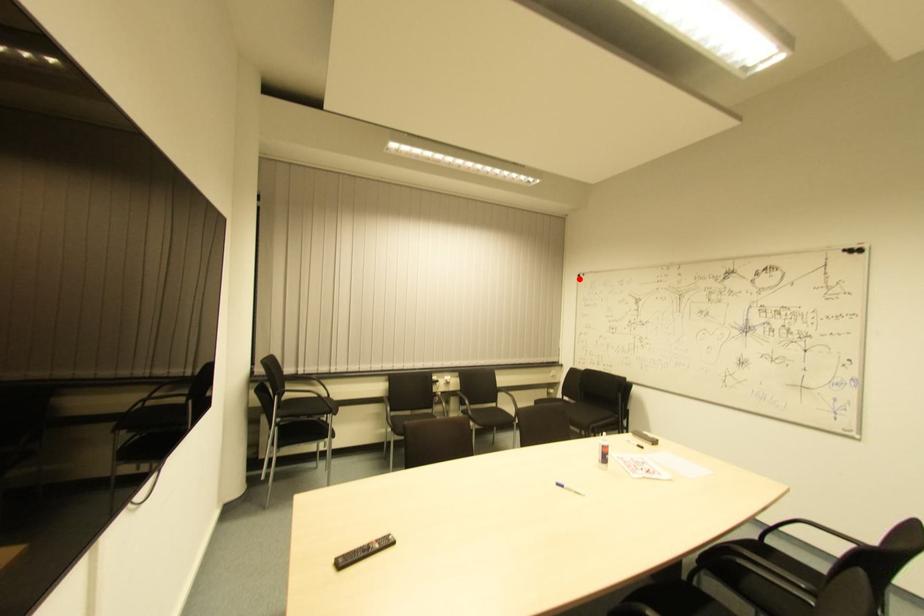
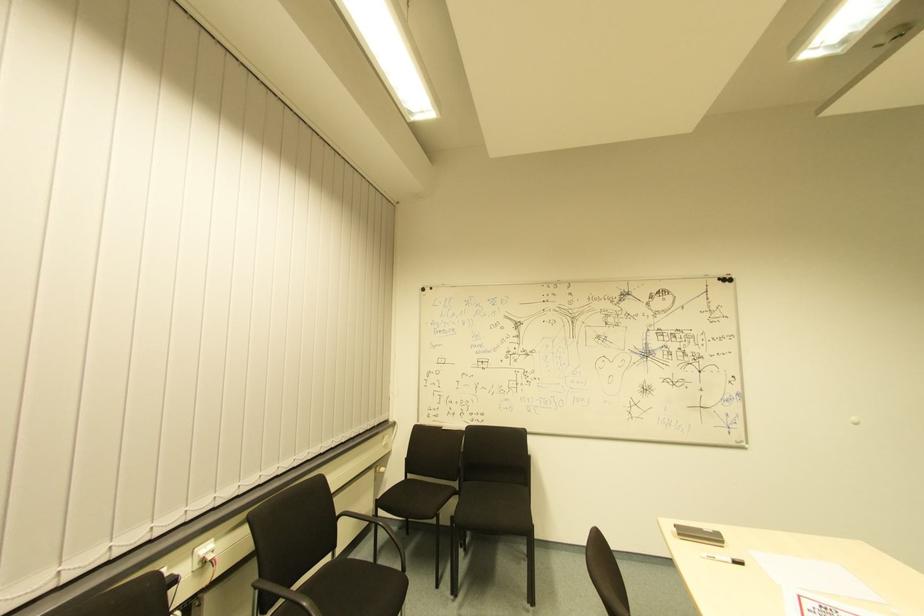
Locate, in the second image, the point that corresponds to the highlighted location in the first image.

(427, 293)